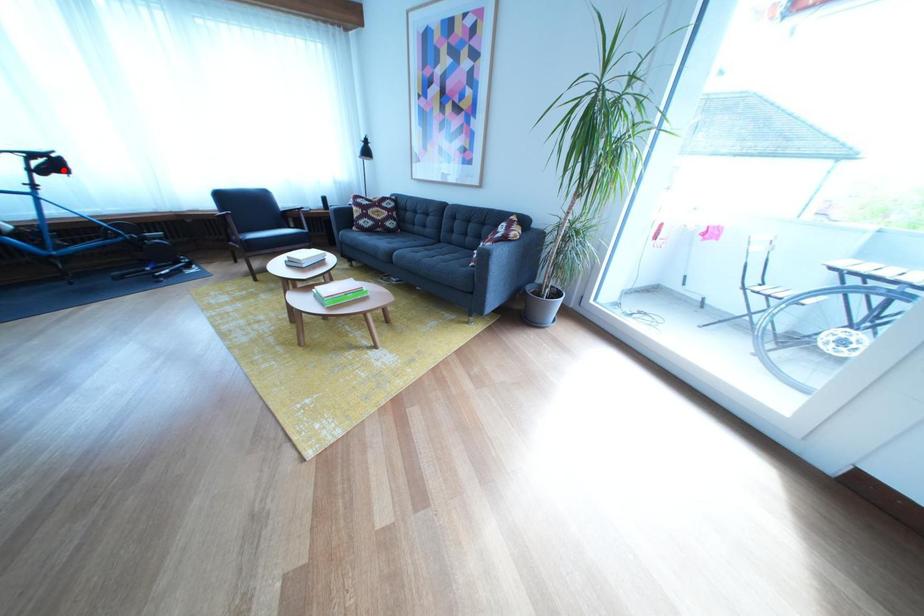
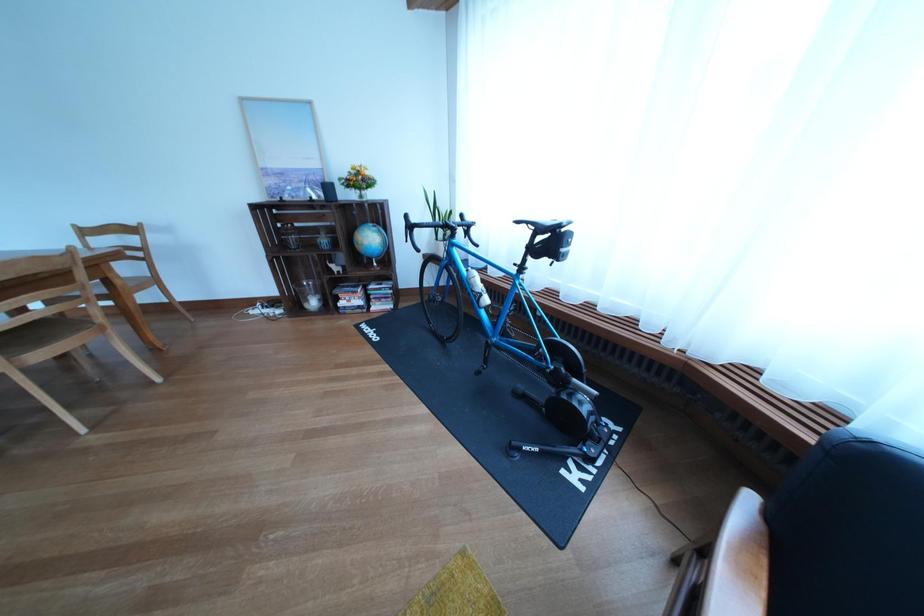
Question: I am providing you with two images of the same scene from different viewpoints. A red point is shown in image1. For the corresponding object point in image2, is it positioned nearer or farther from the camera?

Choices:
 (A) Nearer
 (B) Farther

Answer: (A)